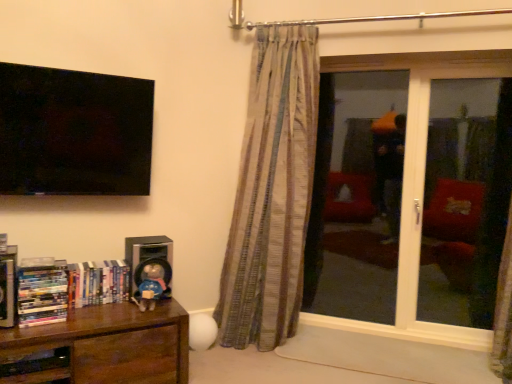
I want to click on vacant area that is situated to the right of hardcover book at left, the 3th book viewed from the right, so click(x=61, y=316).